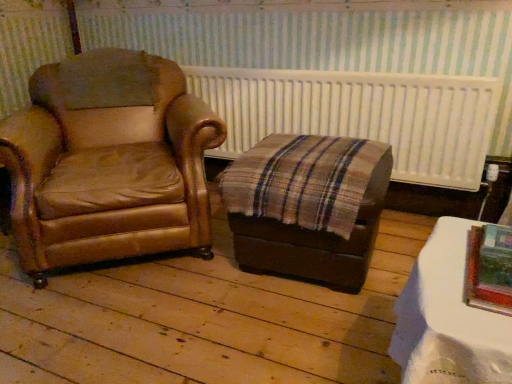
Question: Considering the positions of white textured radiator at upper center and white glossy table at lower right in the image, is white textured radiator at upper center wider or thinner than white glossy table at lower right?

Choices:
 (A) thin
 (B) wide

Answer: (A)

Question: Is white textured radiator at upper center inside or outside of white glossy table at lower right?

Choices:
 (A) inside
 (B) outside

Answer: (B)

Question: Estimate the real-world distances between objects in this image. Which object is closer to the brown leather chair at left?

Choices:
 (A) white glossy table at lower right
 (B) white textured radiator at upper center
 (C) metallic silver picture frame at lower right

Answer: (B)

Question: Considering the real-world distances, which object is closest to the brown leather chair at left?

Choices:
 (A) white textured radiator at upper center
 (B) metallic silver picture frame at lower right
 (C) white glossy table at lower right

Answer: (A)